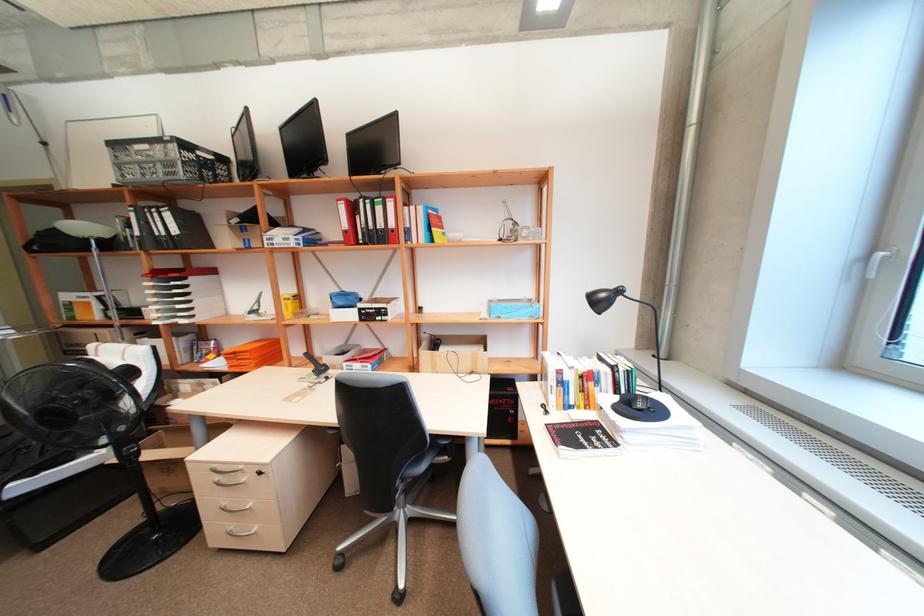
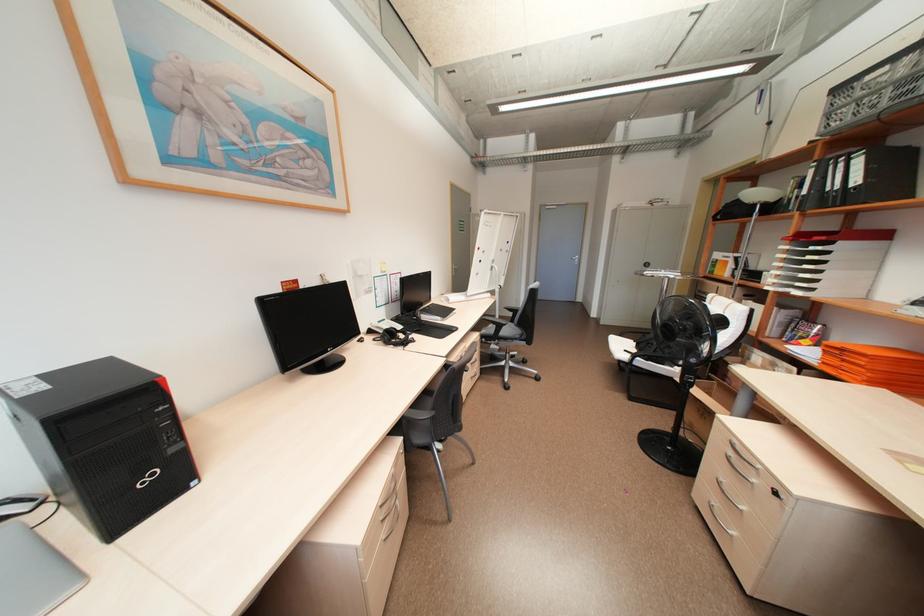
Where in the second image is the point corresponding to the point at 236,533 from the first image?

(716, 506)